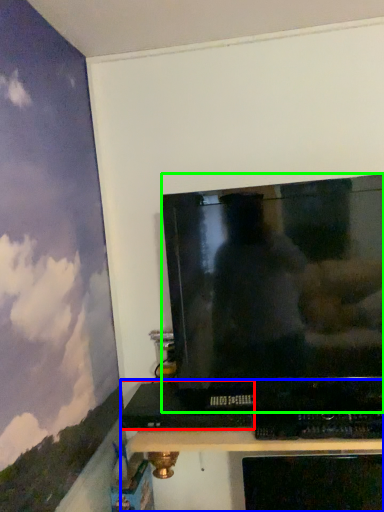
Question: Which object is the farthest from computer (highlighted by a red box)? Choose among these: furniture (highlighted by a blue box) or television (highlighted by a green box).

Choices:
 (A) furniture
 (B) television

Answer: (A)